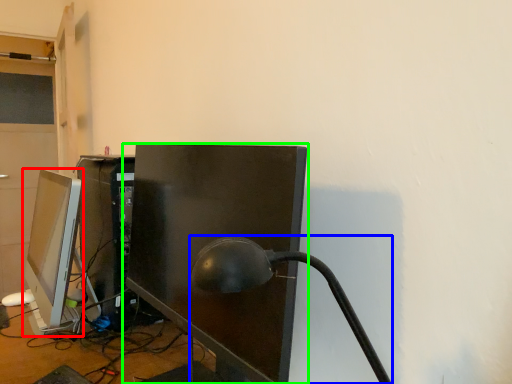
Question: Which object is the closest to the computer monitor (highlighted by a red box)? Choose among these: table lamp (highlighted by a blue box) or computer monitor (highlighted by a green box).

Choices:
 (A) table lamp
 (B) computer monitor

Answer: (B)